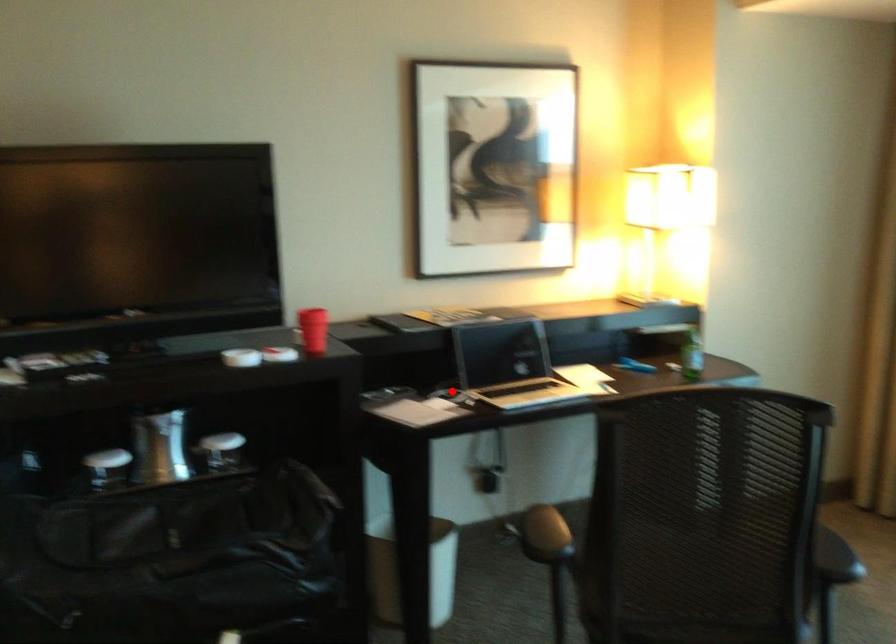
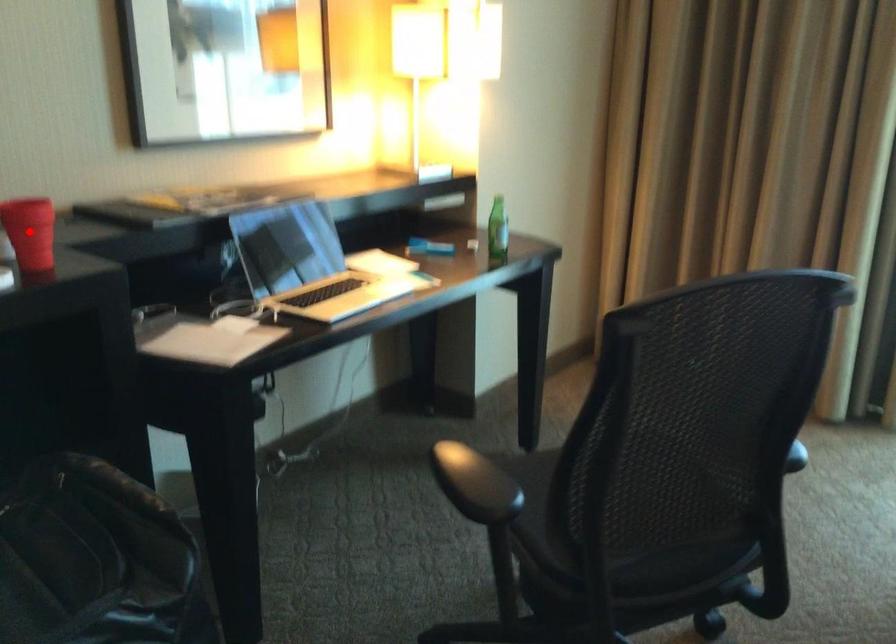
I am providing you with two images of the same scene from different viewpoints. A red point is marked on the first image and another point is marked on the second image. Are the points marked in image1 and image2 representing the same 3D position?

No